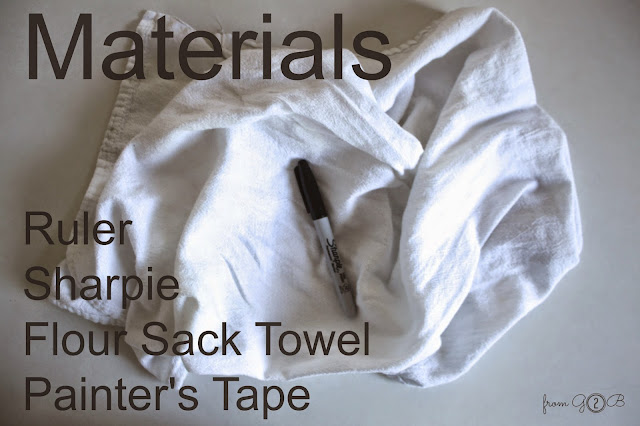
The width and height of the screenshot is (640, 426). I want to click on magic marker, so click(x=324, y=239).